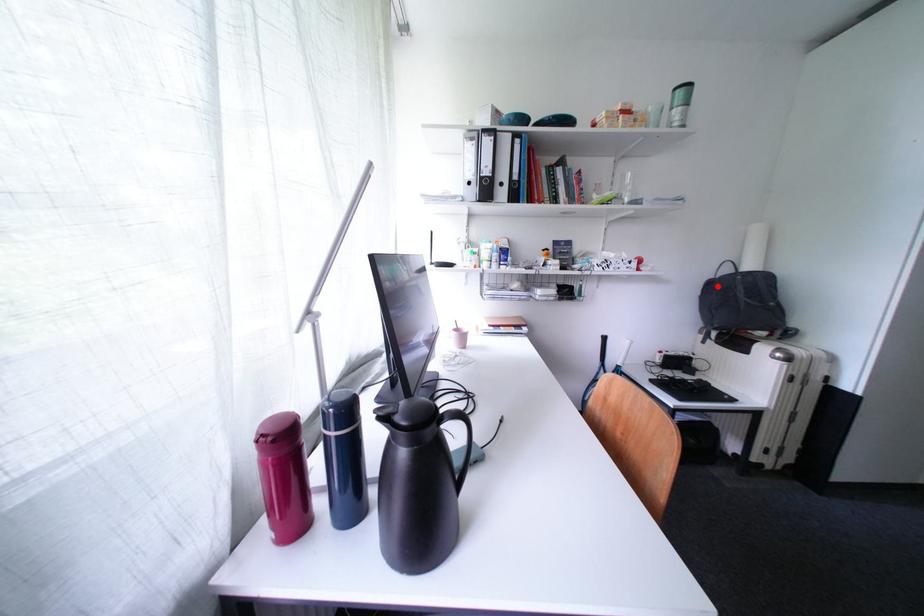
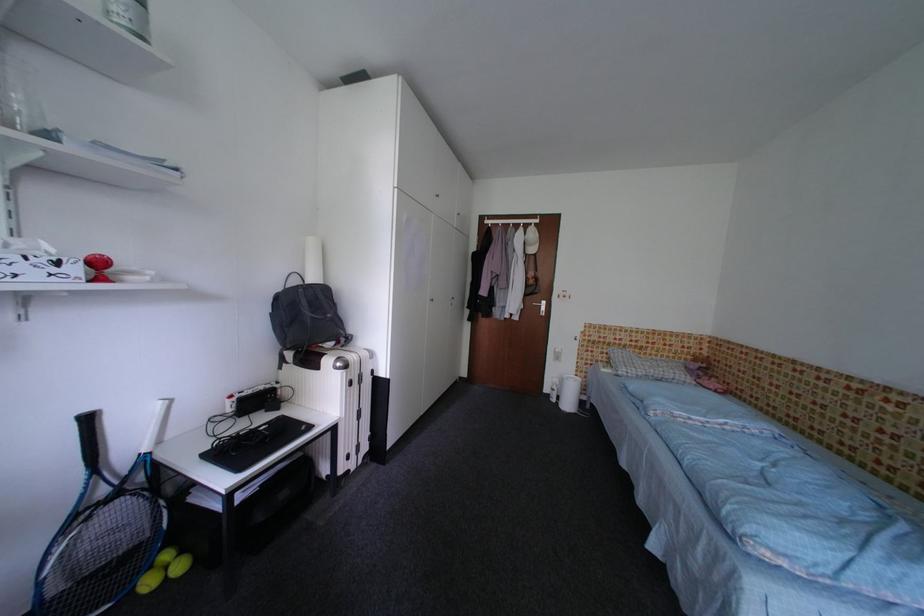
Find the pixel in the second image that matches the highlighted location in the first image.

(286, 301)